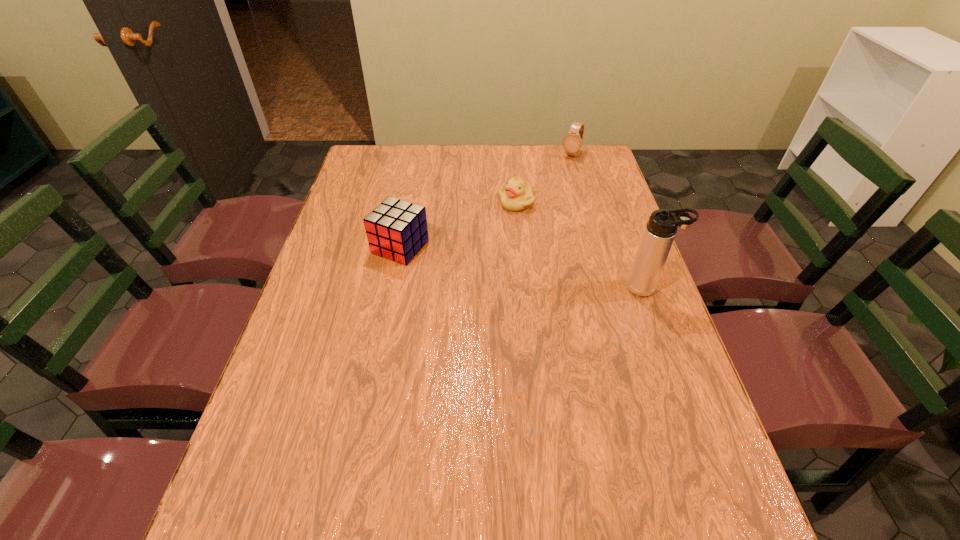
Identify the location of vacant point located between the shortest object and the second object from right to left. (543, 178).

Where is `free space between the duckling and the watch`? The height and width of the screenshot is (540, 960). free space between the duckling and the watch is located at coordinates (543, 178).

The image size is (960, 540). I want to click on vacant point located between the second object from right to left and the thermos bottle, so click(x=609, y=221).

This screenshot has width=960, height=540. Identify the location of unoccupied area between the third nearest object and the thermos bottle. (582, 245).

The width and height of the screenshot is (960, 540). Identify the location of free space between the duckling and the nearest object. [x=582, y=245].

What are the coordinates of `vacant area that lies between the third nearest object and the nearest object` in the screenshot? It's located at (582, 245).

Locate an element on the screen. The width and height of the screenshot is (960, 540). the closest object to the duckling is located at coordinates (397, 230).

The width and height of the screenshot is (960, 540). In order to click on the second closest object to the cube in this screenshot , I will do `click(660, 231)`.

You are a GUI agent. You are given a task and a screenshot of the screen. Output one action in this format:
    pyautogui.click(x=<x>, y=<y>)
    Task: Click on the vacant area that satisfies the following two spatial constraints: 1. on the front side of the rightmost object; 2. on the handle side of the watch
    
    Given the screenshot: What is the action you would take?
    pyautogui.click(x=610, y=288)

Identify the location of free space that satisfies the following two spatial constraints: 1. on the front side of the farthest object; 2. on the handle side of the tallest object. (610, 288).